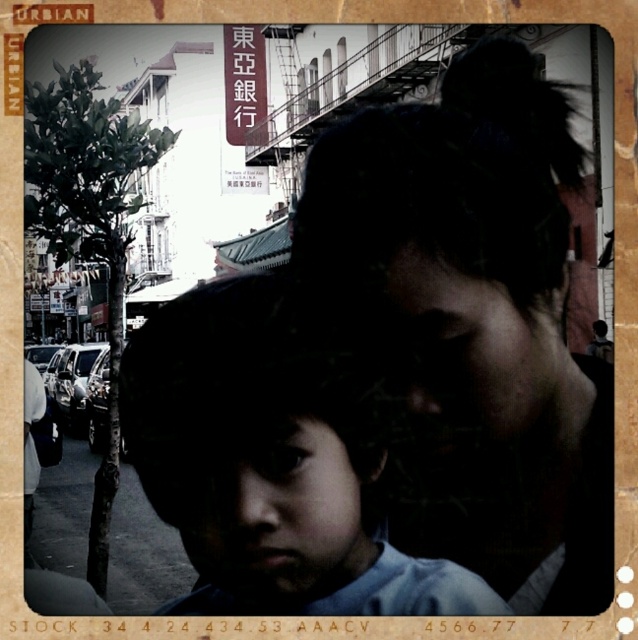
Question: Can you confirm if matte black hair at center is thinner than smooth skin child at center?

Choices:
 (A) yes
 (B) no

Answer: (B)

Question: Does matte black hair at center lie behind smooth skin child at center?

Choices:
 (A) yes
 (B) no

Answer: (A)

Question: Does matte black hair at center have a lesser width compared to smooth skin child at center?

Choices:
 (A) yes
 (B) no

Answer: (B)

Question: Among these points, which one is farthest from the camera?

Choices:
 (A) (299, 346)
 (B) (554, 296)

Answer: (B)

Question: Among these points, which one is nearest to the camera?

Choices:
 (A) (189, 388)
 (B) (568, 528)

Answer: (A)